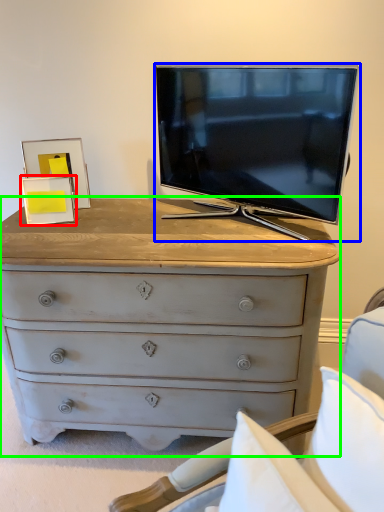
Question: Which object is positioned closest to picture frame (highlighted by a red box)? Select from television (highlighted by a blue box) and chest of drawers (highlighted by a green box).

Choices:
 (A) television
 (B) chest of drawers

Answer: (B)